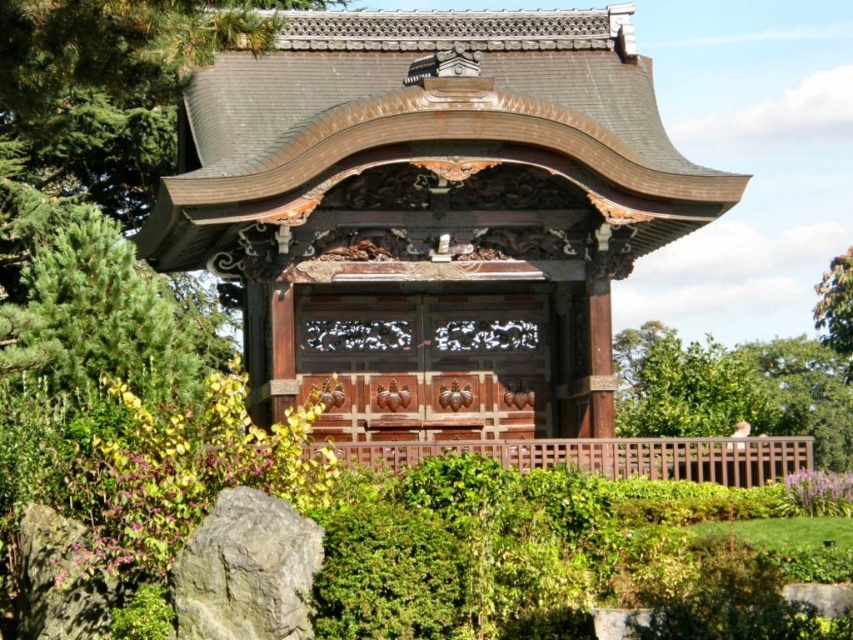
Is point (148, 241) closer to camera compared to point (258, 525)?

No.

Does point (640, 179) come farther from viewer compared to point (186, 612)?

That is True.

Based on the photo, measure the distance between polished wood gazebo at center and camera.

The distance of polished wood gazebo at center from camera is 69.30 meters.

In order to click on polished wood gazebo at center in this screenshot , I will do `click(430, 214)`.